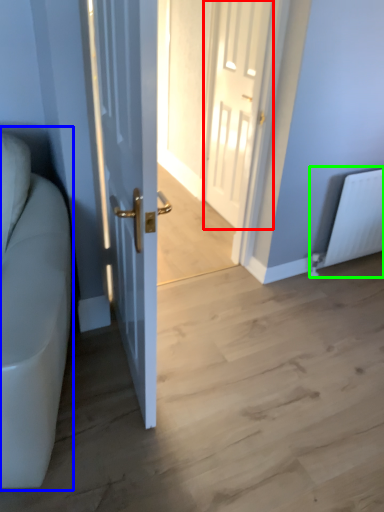
Question: Which is farther away from door (highlighted by a red box)? couch (highlighted by a blue box) or radiator (highlighted by a green box)?

Choices:
 (A) couch
 (B) radiator

Answer: (A)